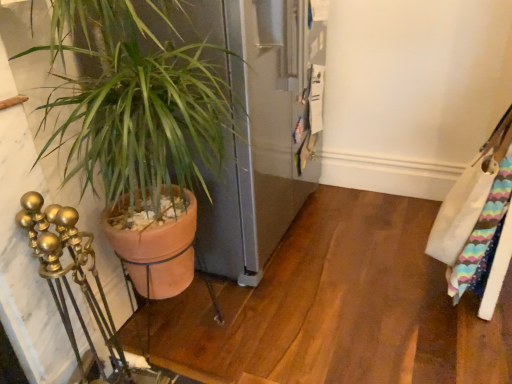
Question: Is terracotta pot at left to the left or to the right of white fabric messenger bag at right in the image?

Choices:
 (A) left
 (B) right

Answer: (A)

Question: Considering their positions, is terracotta pot at left located in front of or behind white fabric messenger bag at right?

Choices:
 (A) front
 (B) behind

Answer: (A)

Question: Which is correct: terracotta pot at left is inside white fabric messenger bag at right, or outside of it?

Choices:
 (A) outside
 (B) inside

Answer: (A)

Question: Considering the positions of point (480, 173) and point (205, 193), is point (480, 173) closer or farther from the camera than point (205, 193)?

Choices:
 (A) closer
 (B) farther

Answer: (B)

Question: From the image's perspective, is white fabric messenger bag at right above or below terracotta pot at left?

Choices:
 (A) below
 (B) above

Answer: (B)

Question: Is white fabric messenger bag at right inside or outside of terracotta pot at left?

Choices:
 (A) outside
 (B) inside

Answer: (A)

Question: From their relative heights in the image, would you say white fabric messenger bag at right is taller or shorter than terracotta pot at left?

Choices:
 (A) tall
 (B) short

Answer: (B)